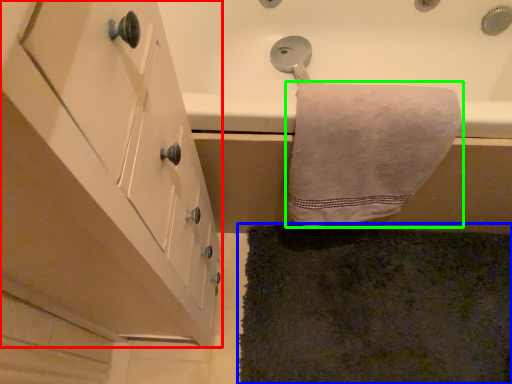
Question: Which object is positioned farthest from cabinetry (highlighted by a red box)? Select from bath mat (highlighted by a blue box) and towel (highlighted by a green box).

Choices:
 (A) bath mat
 (B) towel

Answer: (A)